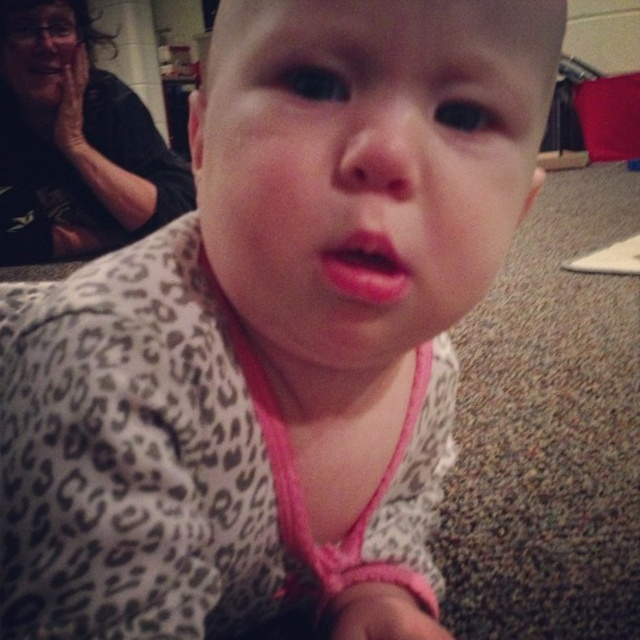
Question: Does matte black shirt at upper left come in front of pink matte lips at center?

Choices:
 (A) no
 (B) yes

Answer: (A)

Question: Is matte black shirt at upper left positioned in front of pink matte lips at center?

Choices:
 (A) no
 (B) yes

Answer: (A)

Question: Which of the following is the closest to the observer?

Choices:
 (A) (394, 288)
 (B) (84, 236)

Answer: (A)

Question: Which of the following is the closest to the observer?

Choices:
 (A) (20, 42)
 (B) (369, 252)

Answer: (B)

Question: Which of the following is the farthest from the observer?

Choices:
 (A) pos(380,284)
 (B) pos(72,10)

Answer: (B)

Question: Is matte black shirt at upper left smaller than pink matte lips at center?

Choices:
 (A) no
 (B) yes

Answer: (A)